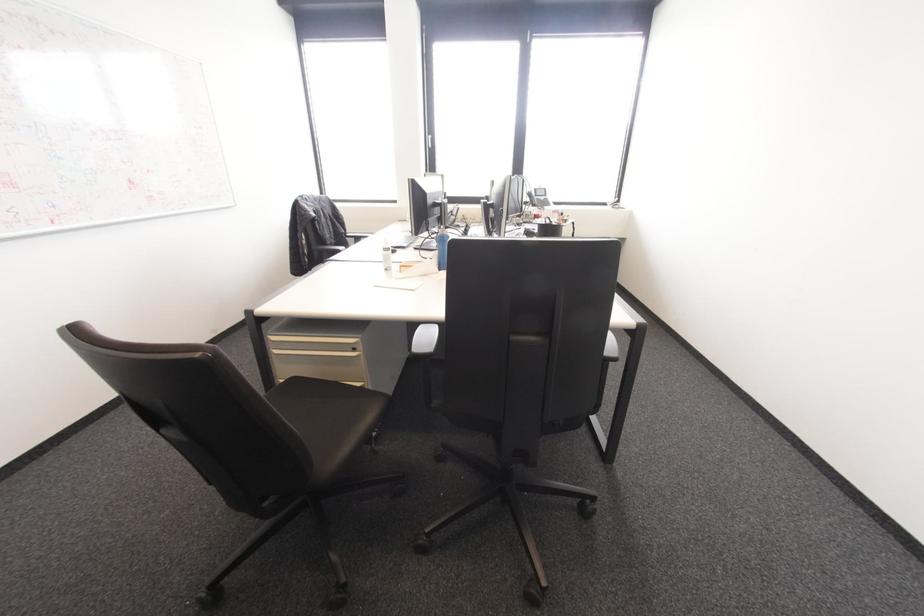
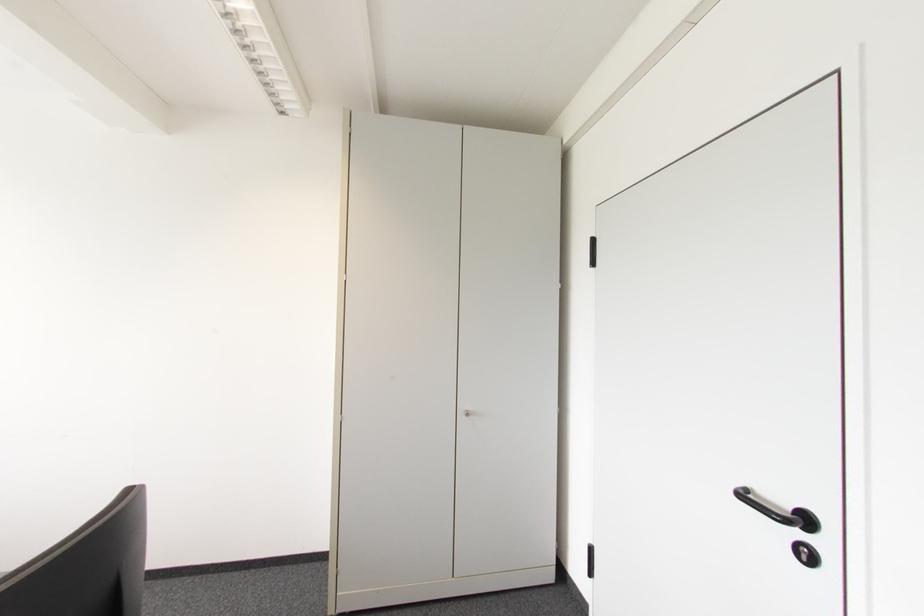
Question: The camera is either moving clockwise (left) or counter-clockwise (right) around the object. The first image is from the beginning of the video and the second image is from the end. Is the camera moving left or right when shooting the video?

Choices:
 (A) Left
 (B) Right

Answer: (A)